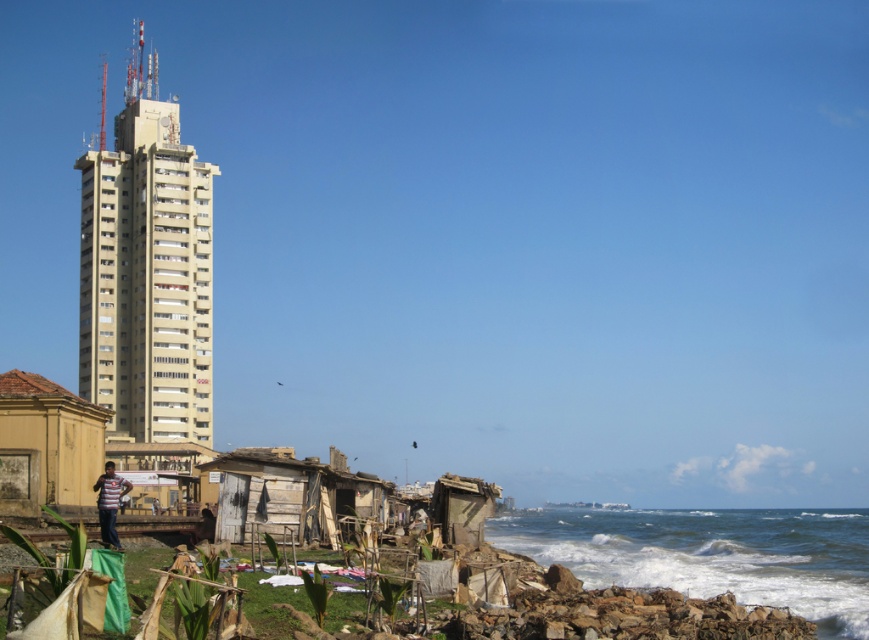
Based on the photo, which of these two, wooden shack at lower left or rusty corrugated metal hut at lower center, stands taller?

wooden shack at lower left is taller.

What are the coordinates of `wooden shack at lower left` in the screenshot? It's located at (161, 468).

Is point (209, 499) positioned behind point (492, 509)?

Yes, it is.

You are a GUI agent. You are given a task and a screenshot of the screen. Output one action in this format:
    pyautogui.click(x=<x>, y=<y>)
    Task: Click on the wooden shack at lower left
    
    Given the screenshot: What is the action you would take?
    pyautogui.click(x=161, y=468)

Who is taller, beige concrete tower at upper left or striped fabric shirt at lower left?

beige concrete tower at upper left is taller.

Can you confirm if beige concrete tower at upper left is positioned above striped fabric shirt at lower left?

Correct, beige concrete tower at upper left is located above striped fabric shirt at lower left.

The width and height of the screenshot is (869, 640). I want to click on beige concrete tower at upper left, so click(146, 269).

Does weathered wood hut at lower center have a lesser height compared to rusty corrugated metal hut at lower center?

No.

Does weathered wood hut at lower center have a lesser width compared to rusty corrugated metal hut at lower center?

Incorrect, weathered wood hut at lower center's width is not less than rusty corrugated metal hut at lower center's.

Is point (377, 481) positioned before point (445, 522)?

No, (377, 481) is behind (445, 522).

At what (x,y) coordinates should I click in order to perform the action: click on weathered wood hut at lower center. Please return your answer as a coordinate pair (x, y). This screenshot has width=869, height=640. Looking at the image, I should click on (290, 492).